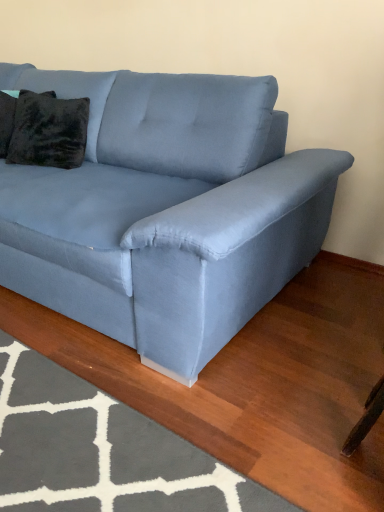
Where is `free spot above gray textured rug at lower left (from a real-world perspective)`? The height and width of the screenshot is (512, 384). free spot above gray textured rug at lower left (from a real-world perspective) is located at coordinates (76, 431).